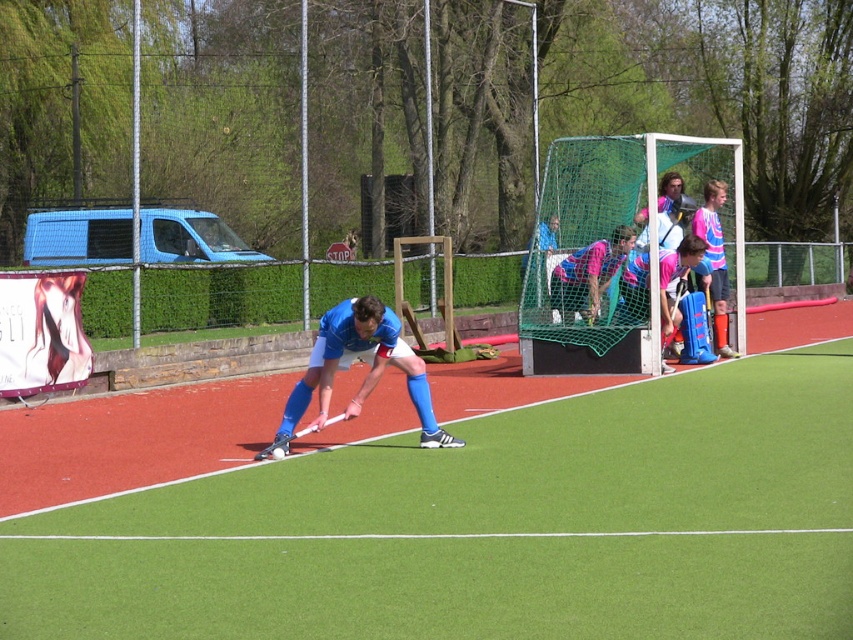
Is green artificial turf at center positioned at the back of pink jersey at goal?

That is False.

Find the location of a particular element. This screenshot has width=853, height=640. green artificial turf at center is located at coordinates (450, 506).

I want to click on green artificial turf at center, so click(x=450, y=506).

Between point (206, 497) and point (711, 218), which one is positioned behind?

Positioned behind is point (711, 218).

Is point (189, 509) positioned after point (717, 280)?

No, it is not.

At what (x,y) coordinates should I click in order to perform the action: click on green artificial turf at center. Please return your answer as a coordinate pair (x, y). The width and height of the screenshot is (853, 640). Looking at the image, I should click on (450, 506).

Is matte pink jersey at center below pink striped shirt at right?

Yes.

Who is taller, matte pink jersey at center or pink striped shirt at right?

pink striped shirt at right

Who is more forward, (x=680, y=275) or (x=711, y=212)?

Point (x=680, y=275) is more forward.

Find the location of `matte pink jersey at center`. matte pink jersey at center is located at coordinates (675, 280).